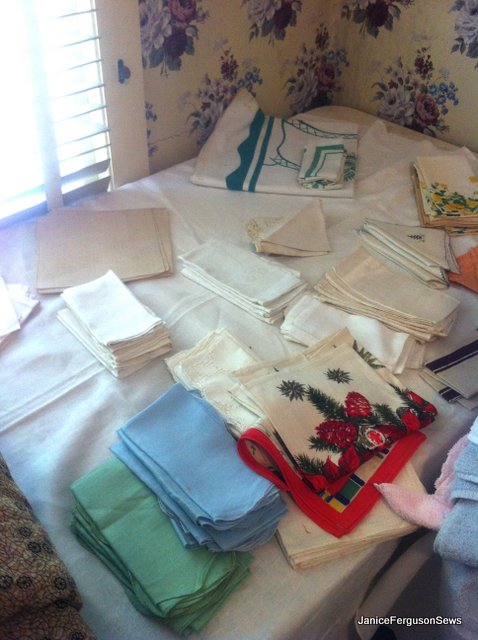
The width and height of the screenshot is (478, 640). I want to click on window frame, so click(x=104, y=28).